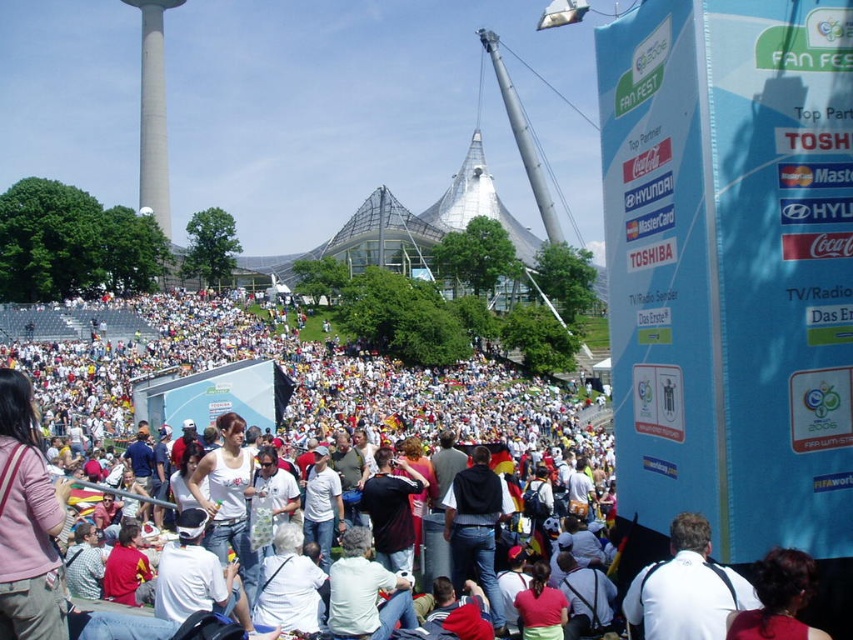
Does white fabric shirt at center appear over dark red hair at center?

No.

Is white fabric shirt at center thinner than dark red hair at center?

In fact, white fabric shirt at center might be wider than dark red hair at center.

Between point (654, 568) and point (769, 628), which one is positioned in front?

Point (769, 628) is more forward.

This screenshot has width=853, height=640. In order to click on white fabric shirt at center in this screenshot , I will do `click(686, 588)`.

Does white casual clothing at center have a larger size compared to smooth concrete tower at upper left?

Indeed, white casual clothing at center has a larger size compared to smooth concrete tower at upper left.

Describe the element at coordinates (277, 387) in the screenshot. The height and width of the screenshot is (640, 853). I see `white casual clothing at center` at that location.

Locate an element on the screen. The width and height of the screenshot is (853, 640). white casual clothing at center is located at coordinates (277, 387).

Between white casual clothing at center and dark red hair at center, which one has less height?

With less height is dark red hair at center.

Does white casual clothing at center have a smaller size compared to dark red hair at center?

Actually, white casual clothing at center might be larger than dark red hair at center.

Is point (544, 422) closer to camera compared to point (790, 548)?

No, it is behind (790, 548).

The width and height of the screenshot is (853, 640). Find the location of `white casual clothing at center`. white casual clothing at center is located at coordinates (277, 387).